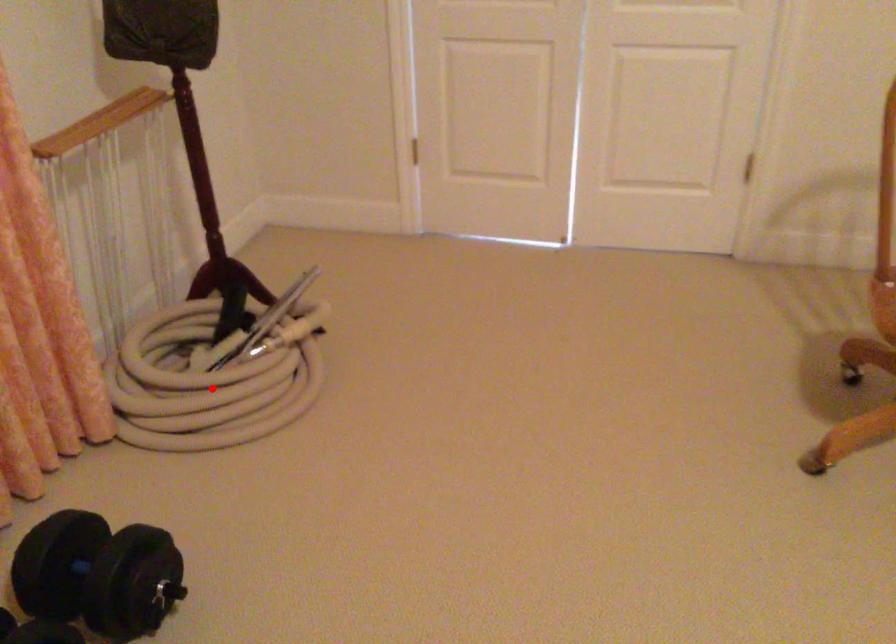
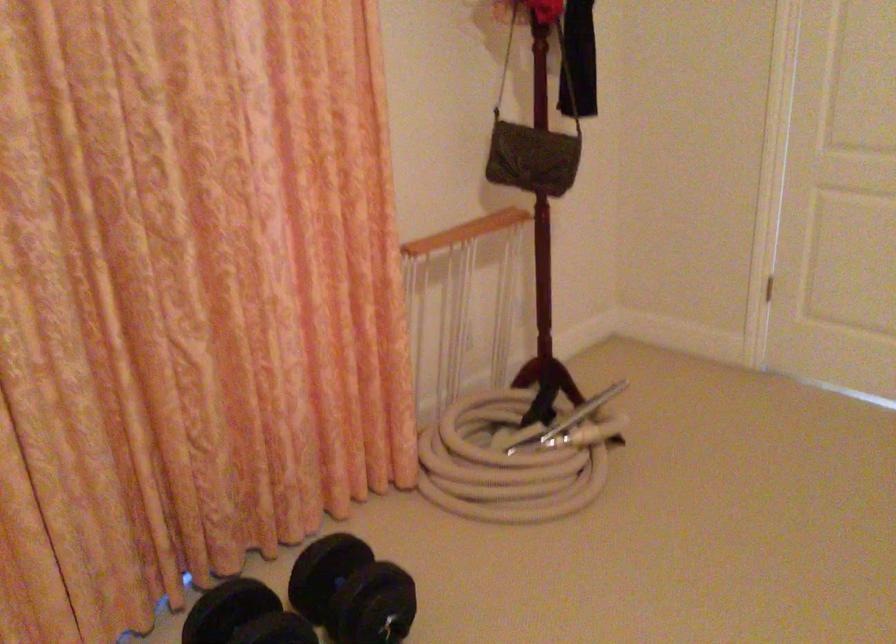
Find the pixel in the second image that matches the highlighted location in the first image.

(503, 466)